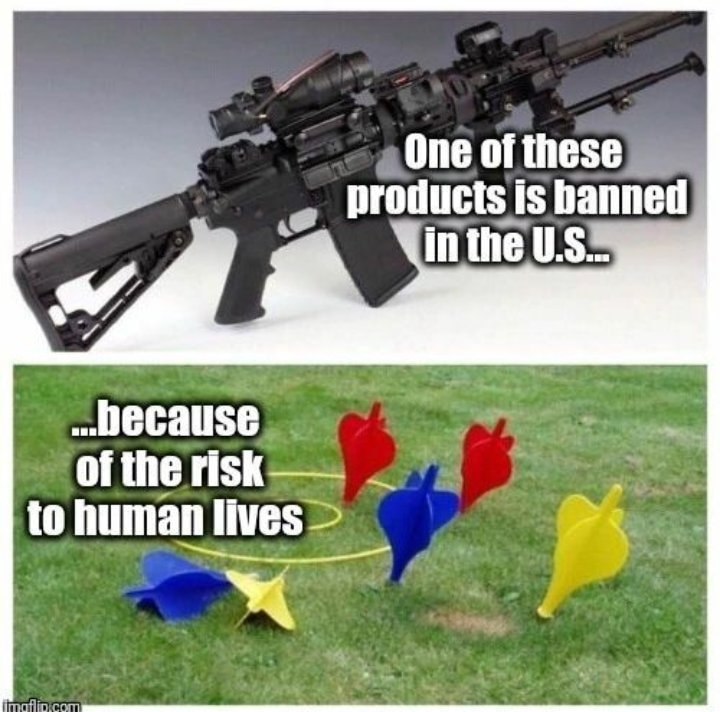
Locate an element on the screen. Image resolution: width=720 pixels, height=712 pixels. handle is located at coordinates (260, 253).